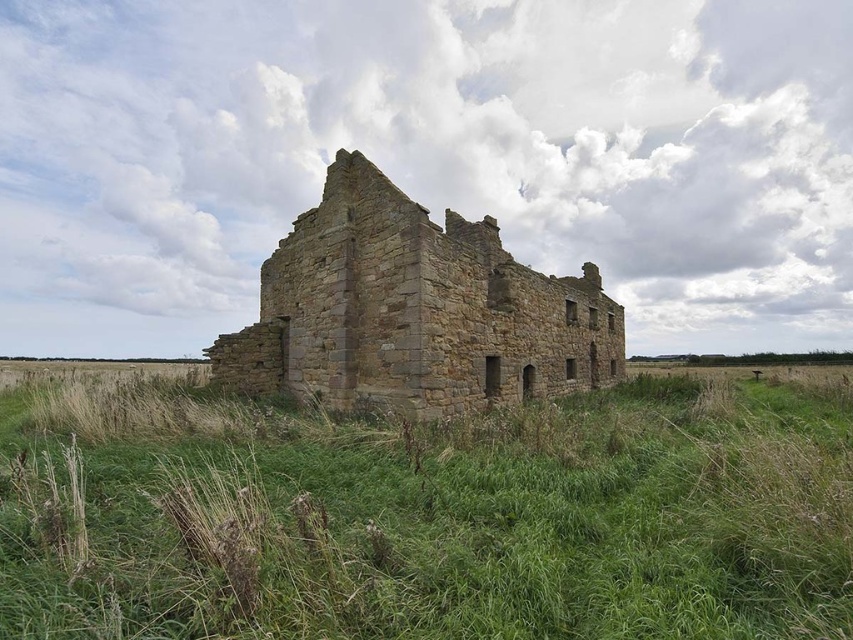
Is green grass at center to the right of brown stone castle at center from the viewer's perspective?

In fact, green grass at center is to the left of brown stone castle at center.

Describe the element at coordinates (427, 515) in the screenshot. I see `green grass at center` at that location.

Between point (711, 461) and point (227, 378), which one is positioned behind?

The point (227, 378) is more distant.

Where is `green grass at center`? This screenshot has height=640, width=853. green grass at center is located at coordinates (427, 515).